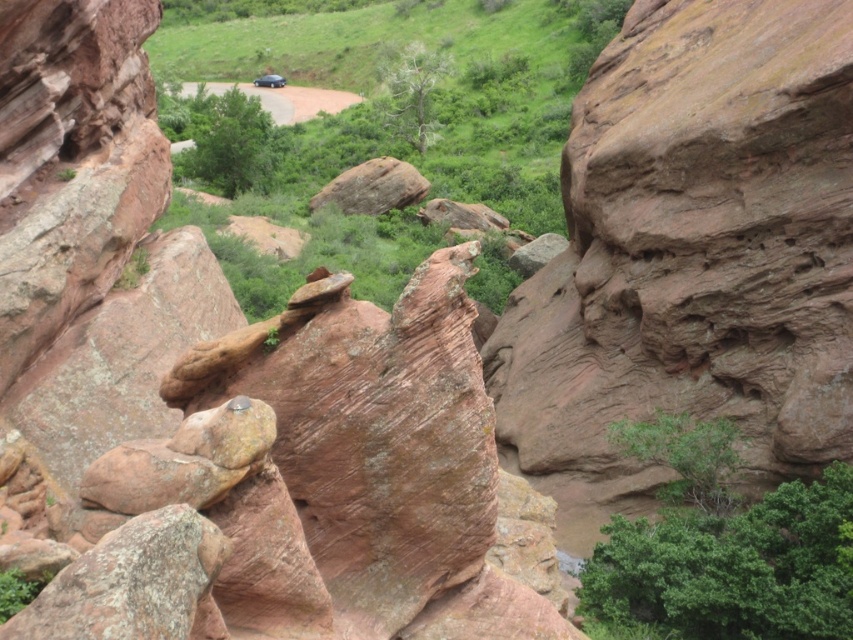
Is point (91, 380) positioned behind point (347, 188)?

That is False.

Is rusty stone boulder at center bigger than rusty rock at center?

Correct, rusty stone boulder at center is larger in size than rusty rock at center.

Measure the distance between point (132, 387) and camera.

Point (132, 387) is 83.02 feet from camera.

You are a GUI agent. You are given a task and a screenshot of the screen. Output one action in this format:
    pyautogui.click(x=<x>, y=<y>)
    Task: Click on the rusty stone boulder at center
    This screenshot has height=640, width=853.
    Given the screenshot: What is the action you would take?
    pyautogui.click(x=225, y=396)